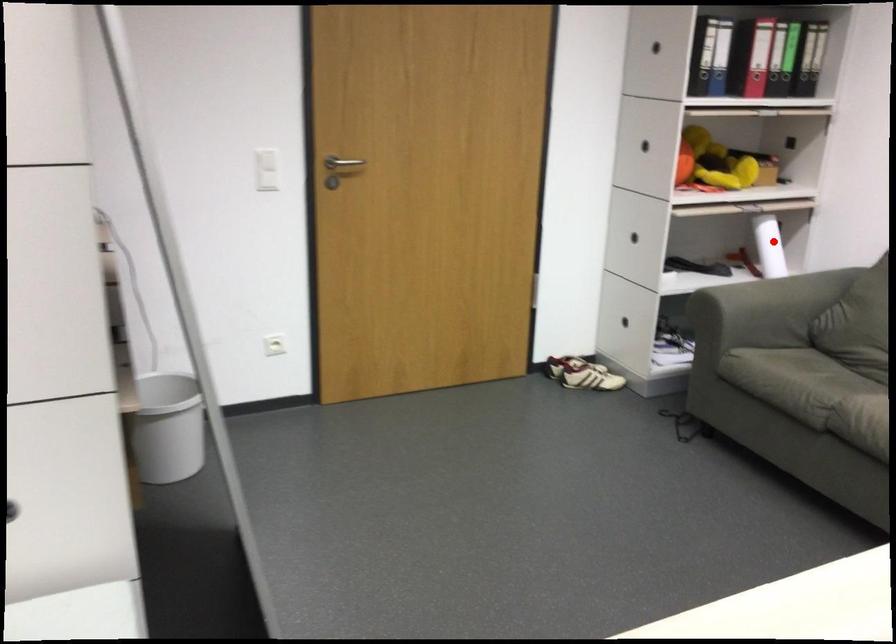
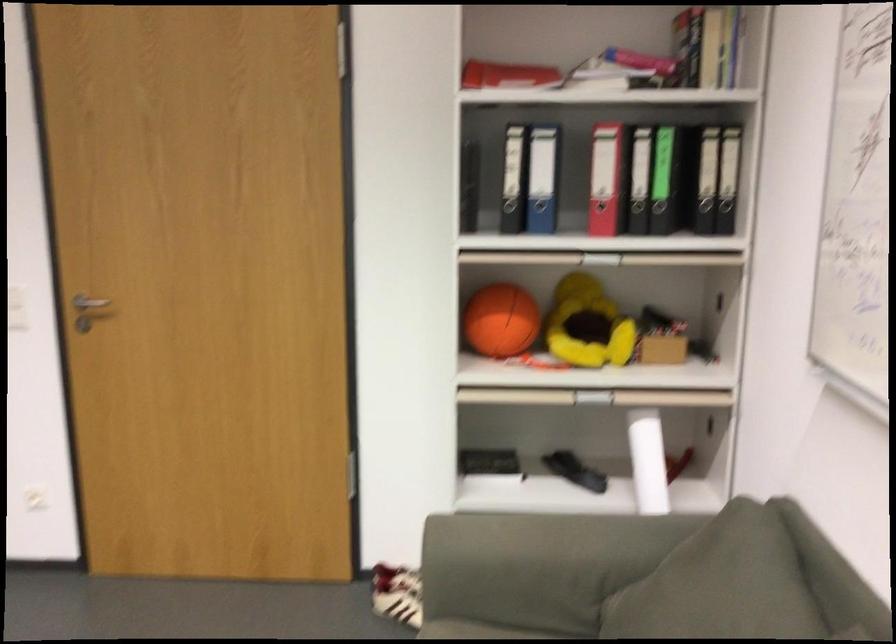
In the second image, find the point that corresponds to the highlighted location in the first image.

(648, 460)